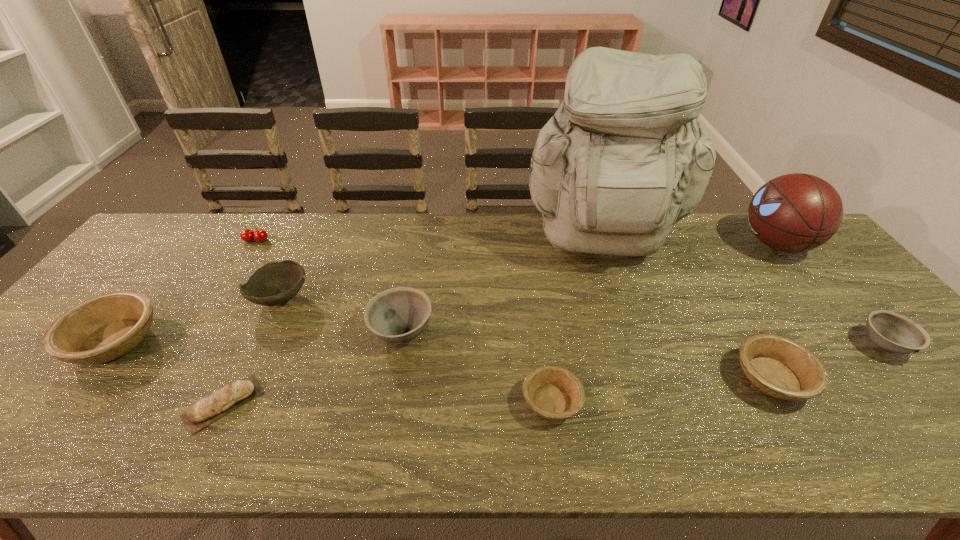
Locate an element on the screen. The image size is (960, 540). the rightmost bowl is located at coordinates (893, 332).

Find the location of a particular element. The height and width of the screenshot is (540, 960). the fifth bowl from left to right is located at coordinates click(778, 366).

The width and height of the screenshot is (960, 540). What are the coordinates of `the rightmost beige bowl` in the screenshot? It's located at (778, 366).

Identify the location of the smallest beige bowl. This screenshot has height=540, width=960. (555, 393).

Where is `the second beige bowl from right to left`? This screenshot has height=540, width=960. the second beige bowl from right to left is located at coordinates (555, 393).

This screenshot has height=540, width=960. Identify the location of pita bread. (219, 403).

Locate an element on the screen. This screenshot has height=540, width=960. vacant area located on the front-facing side of the backpack is located at coordinates (620, 303).

The image size is (960, 540). What are the coordinates of `vacant area located 0.370m on the left of the second tallest object` in the screenshot? It's located at (624, 244).

Locate an element on the screen. This screenshot has height=540, width=960. vacant space located with the stems of the eighth shortest object pointing upwards is located at coordinates (224, 293).

Locate an element on the screen. The image size is (960, 540). free space located 0.330m on the right of the sixth object from right to left is located at coordinates (562, 332).